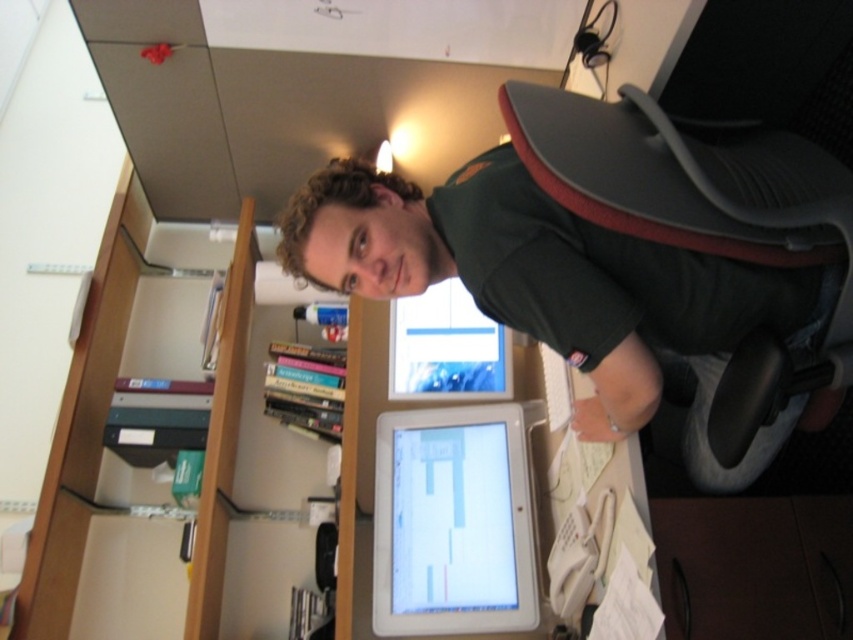
You are organizing the desk and need to place a new item between the dark green shirt at upper center and the wooden at left. Is there enough space between them for the item?

The dark green shirt at upper center is to the right of the wooden at left, so there is space between them to place the new item.

You are an office worker who needs to hang a picture frame that is 1.2 meters tall. The frame must be placed above the wooden at left but below the dark green shirt at upper center. Is this possible?

The dark green shirt at upper center is shorter than the wooden at left. Therefore, the picture frame cannot be placed above the wooden at left and below the dark green shirt at upper center because the wooden at left is taller than the dark green shirt at upper center.